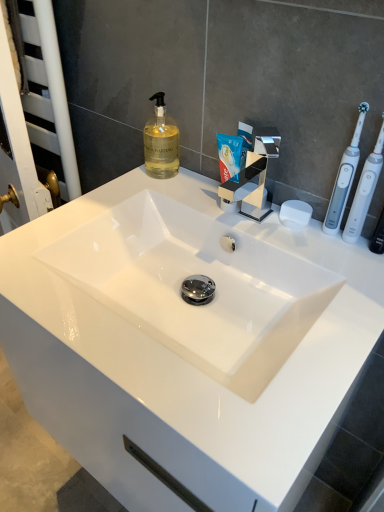
What are the coordinates of `free space in front of white matte soap at right` in the screenshot? It's located at (322, 269).